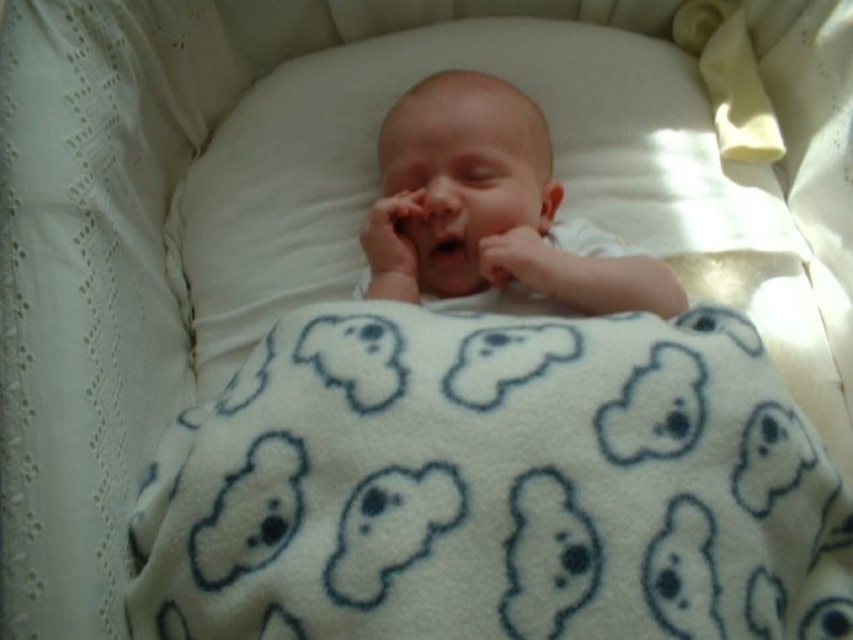
Who is more distant from viewer, (358,600) or (593,54)?

The point (593,54) is more distant.

Is white fleece blanket at center wider than white soft pillow at center?

In fact, white fleece blanket at center might be narrower than white soft pillow at center.

What do you see at coordinates (494, 486) in the screenshot?
I see `white fleece blanket at center` at bounding box center [494, 486].

Where is `white fleece blanket at center`? This screenshot has height=640, width=853. white fleece blanket at center is located at coordinates (494, 486).

Does white fleece blanket at center lie behind smooth white newborn at center?

No, white fleece blanket at center is in front of smooth white newborn at center.

Is white fleece blanket at center wider than smooth white newborn at center?

Yes, white fleece blanket at center is wider than smooth white newborn at center.

Find the location of a particular element. white fleece blanket at center is located at coordinates (494, 486).

Locate an element on the screen. The width and height of the screenshot is (853, 640). white fleece blanket at center is located at coordinates (x=494, y=486).

Is point (639, 180) positioned after point (546, 257)?

Yes.

At what (x,y) coordinates should I click in order to perform the action: click on white soft pillow at center. Please return your answer as a coordinate pair (x, y). The width and height of the screenshot is (853, 640). Looking at the image, I should click on (376, 173).

Does point (560, 150) come closer to viewer compared to point (407, 128)?

That is False.

Where is `white soft pillow at center`? This screenshot has width=853, height=640. white soft pillow at center is located at coordinates (376, 173).